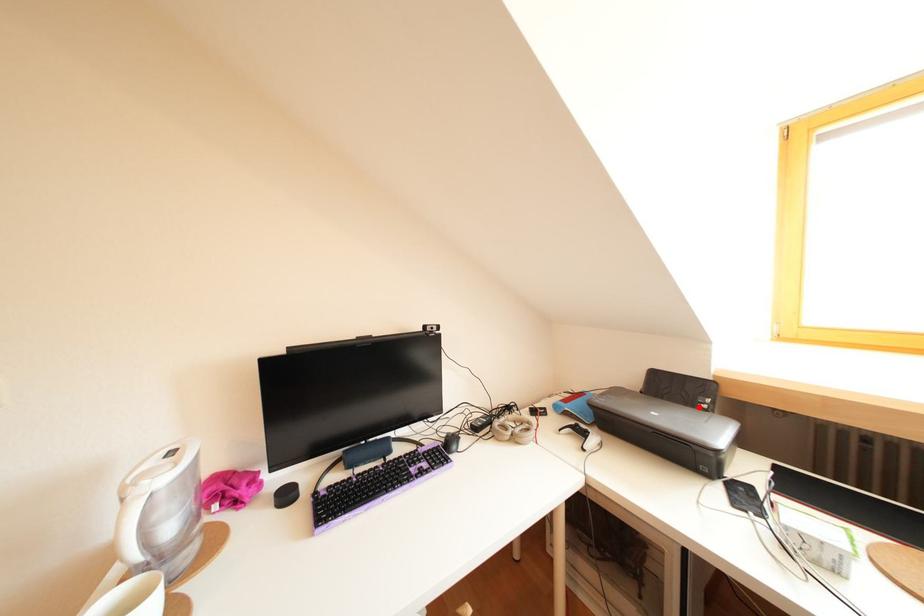
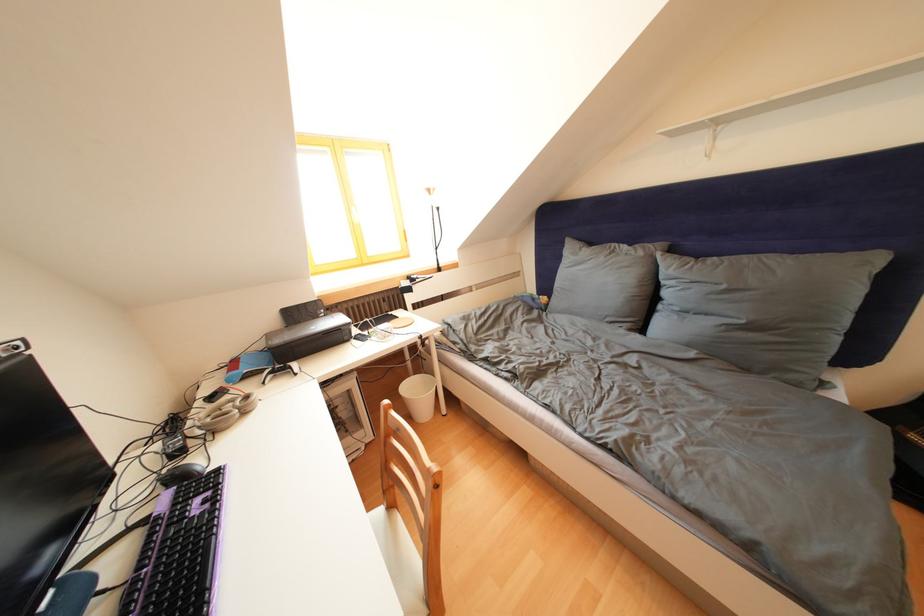
Where in the second image is the point corresponding to the highlighted location from the first image?

(323, 322)